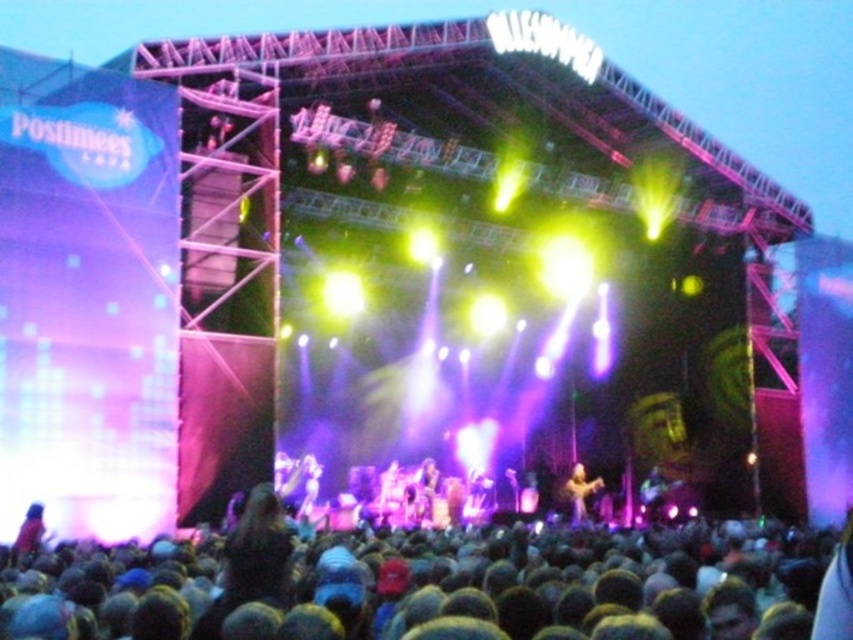
Question: Which of these objects is positioned farthest from the smooth pink shirt at lower left?

Choices:
 (A) shiny black guitar at center
 (B) dark hair crowd at lower center
 (C) metallic silver microphone at center

Answer: (A)

Question: Which point appears farthest from the camera in this image?

Choices:
 (A) (572, 497)
 (B) (654, 516)
 (C) (54, 637)
 (D) (308, 504)

Answer: (A)

Question: Does smooth pink shirt at lower left appear under shiny gold guitar at center?

Choices:
 (A) yes
 (B) no

Answer: (B)

Question: Can you confirm if smooth pink shirt at lower left is wider than shiny gold guitar at center?

Choices:
 (A) yes
 (B) no

Answer: (B)

Question: Is dark hair crowd at lower center to the right of shiny gold guitar at center from the viewer's perspective?

Choices:
 (A) yes
 (B) no

Answer: (B)

Question: Which object is farther from the camera taking this photo?

Choices:
 (A) metallic silver microphone at center
 (B) shiny black guitar at center
 (C) shiny gold guitar at center
 (D) smooth pink shirt at lower left

Answer: (B)